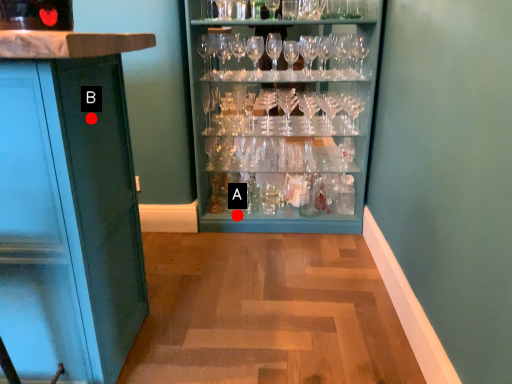
Question: Two points are circled on the image, labeled by A and B beside each circle. Which point is farther from the camera taking this photo?

Choices:
 (A) A is further
 (B) B is further

Answer: (A)